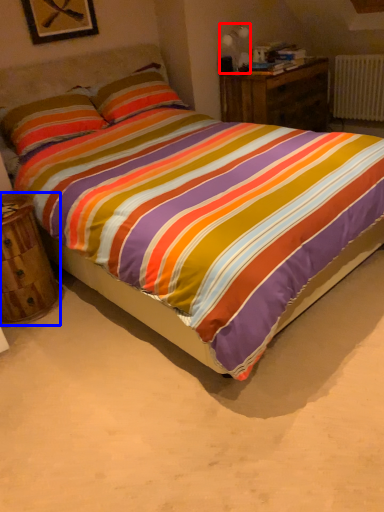
Question: Among these objects, which one is farthest to the camera, table lamp (highlighted by a red box) or nightstand (highlighted by a blue box)?

Choices:
 (A) table lamp
 (B) nightstand

Answer: (A)